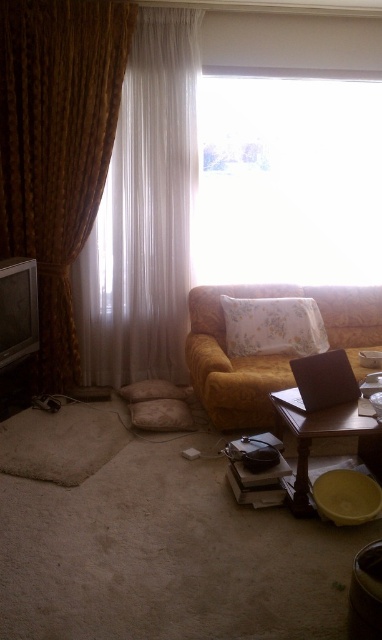
Question: Among these points, which one is farthest from the camera?

Choices:
 (A) (283, 362)
 (B) (237, 349)
 (C) (55, 304)
 (D) (137, 140)

Answer: (C)

Question: Is floral fabric pillow at center in front of wooden table at lower right?

Choices:
 (A) yes
 (B) no

Answer: (B)

Question: Observing the image, what is the correct spatial positioning of transparent glass window at upper center in reference to gold textured curtain at left?

Choices:
 (A) left
 (B) right

Answer: (B)

Question: Which of the following is the farthest from the observer?

Choices:
 (A) (305, 451)
 (B) (210, 308)

Answer: (B)

Question: Which point appears closest to the camera in this image?

Choices:
 (A) (189, 237)
 (B) (291, 429)
 (C) (286, 387)
 (D) (241, 336)

Answer: (B)

Question: Does white sheer curtain at left lie behind floral fabric pillow at center?

Choices:
 (A) no
 (B) yes

Answer: (A)